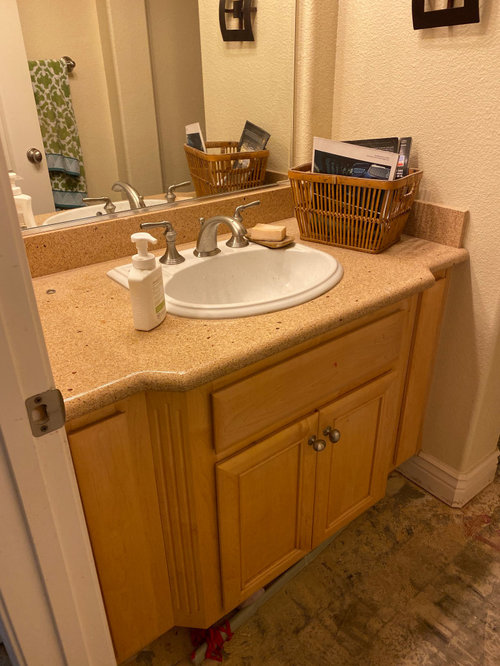
At what (x,y) coordinates should I click in order to perform the action: click on cabinet doors. Please return your answer as a coordinate pair (x, y). This screenshot has height=666, width=500. Looking at the image, I should click on (293, 469), (342, 475).